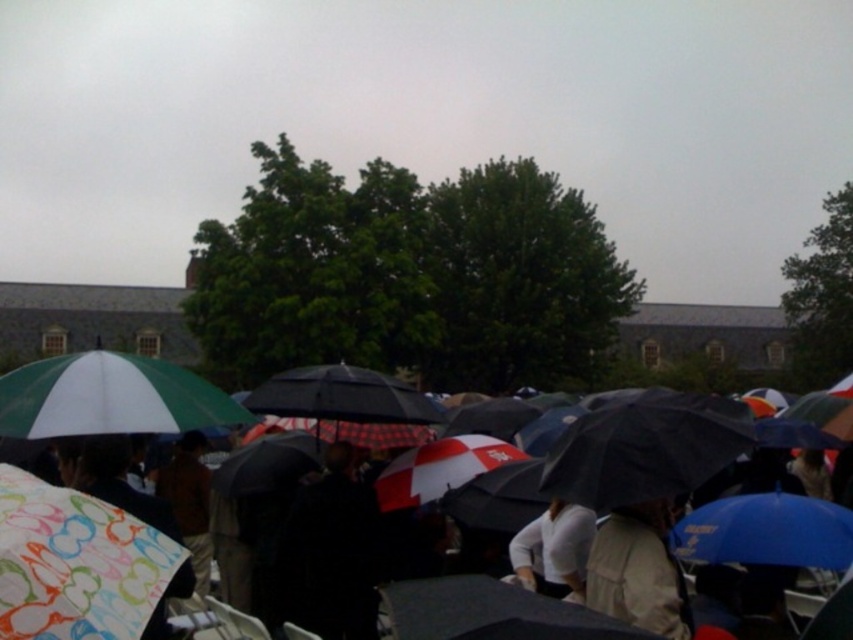
You are standing in the crowd and want to move forward. There are two points marked in the image. Which point, point [138,588] or point [53,390], is closer to you?

Point [138,588] is closer to you because it is in front of point [53,390].

You are standing in the crowd holding a small umbrella. You notice two umbrellas in the scene, the patterned fabric umbrella at lower left and the green matte umbrella at upper left. Which one is smaller in size?

The patterned fabric umbrella at lower left is smaller in size compared to the green matte umbrella at upper left.

You are part of a crowd holding an umbrella and want to see the stage ahead. You notice a patterned fabric umbrella at lower left and a green matte umbrella at upper left. Which umbrella is blocking your view?

The patterned fabric umbrella at lower left is in front of the green matte umbrella at upper left, so it is blocking your view.